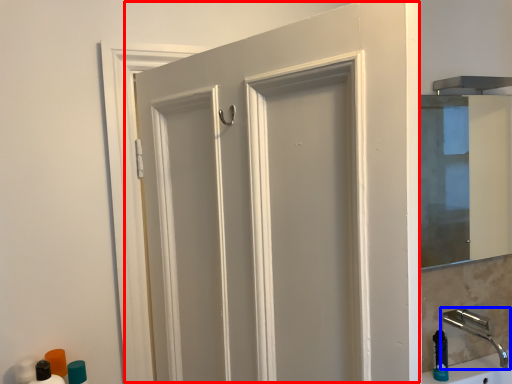
Question: Which of the following is the farthest to the observer, door (highlighted by a red box) or tap (highlighted by a blue box)?

Choices:
 (A) door
 (B) tap

Answer: (B)